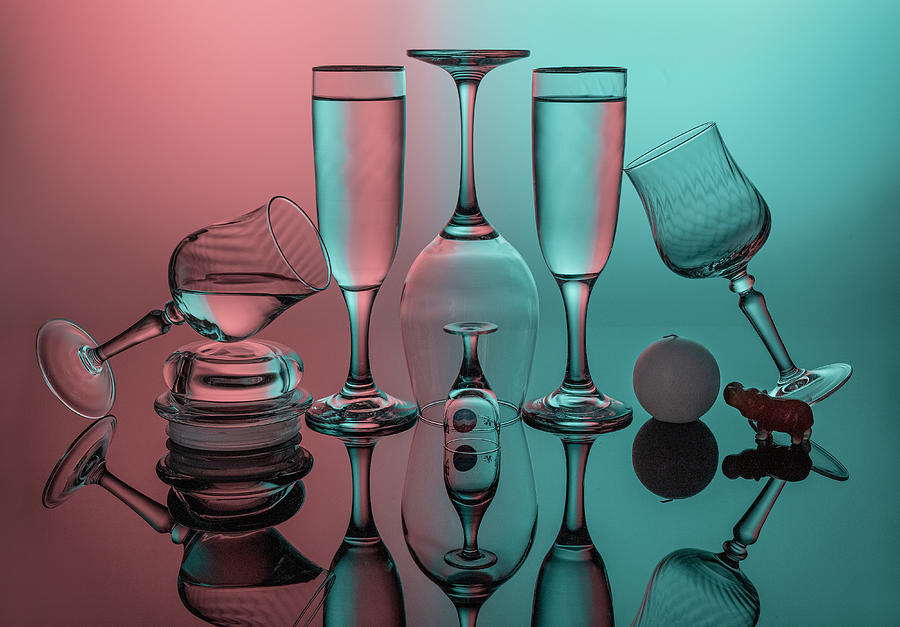
The height and width of the screenshot is (627, 900). I want to click on toy, so click(777, 422).